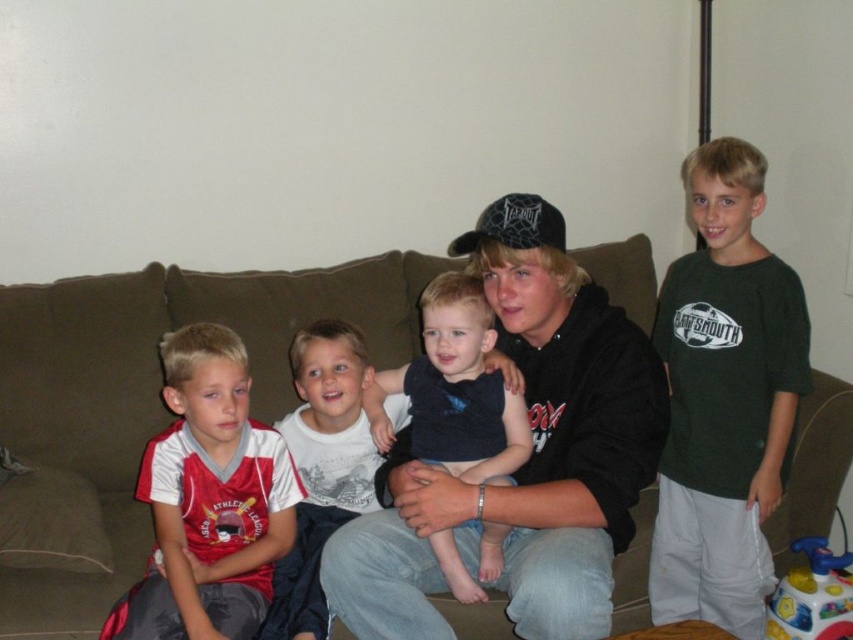
Between brown fabric couch at center and black matte hoodie at center, which one is positioned higher?

brown fabric couch at center is higher up.

Between brown fabric couch at center and black matte hoodie at center, which one appears on the left side from the viewer's perspective?

brown fabric couch at center is more to the left.

What do you see at coordinates (144, 404) in the screenshot? The image size is (853, 640). I see `brown fabric couch at center` at bounding box center [144, 404].

This screenshot has width=853, height=640. Identify the location of brown fabric couch at center. (144, 404).

Can you confirm if dark green t-shirt at right is smaller than plastic colorful ball at lower right?

No.

Does dark green t-shirt at right have a lesser height compared to plastic colorful ball at lower right?

No, dark green t-shirt at right is not shorter than plastic colorful ball at lower right.

Image resolution: width=853 pixels, height=640 pixels. What are the coordinates of `dark green t-shirt at right` in the screenshot? It's located at (724, 397).

Is dark blue sleeveless shirt at center to the right of plastic colorful ball at lower right from the viewer's perspective?

In fact, dark blue sleeveless shirt at center is to the left of plastic colorful ball at lower right.

Can you confirm if dark blue sleeveless shirt at center is positioned to the left of plastic colorful ball at lower right?

Yes, dark blue sleeveless shirt at center is to the left of plastic colorful ball at lower right.

This screenshot has width=853, height=640. I want to click on dark blue sleeveless shirt at center, so click(454, 390).